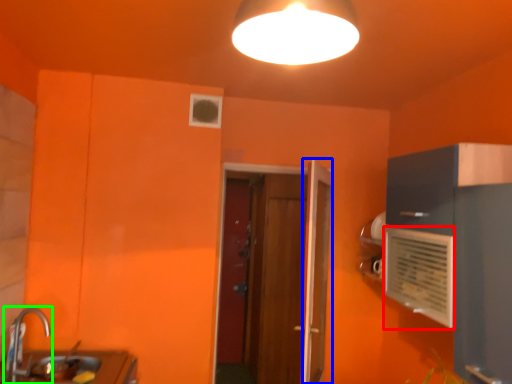
Question: Based on their relative distances, which object is farther from air conditioning (highlighted by a red box)? Choose from door (highlighted by a blue box) and tap (highlighted by a green box).

Choices:
 (A) door
 (B) tap

Answer: (B)